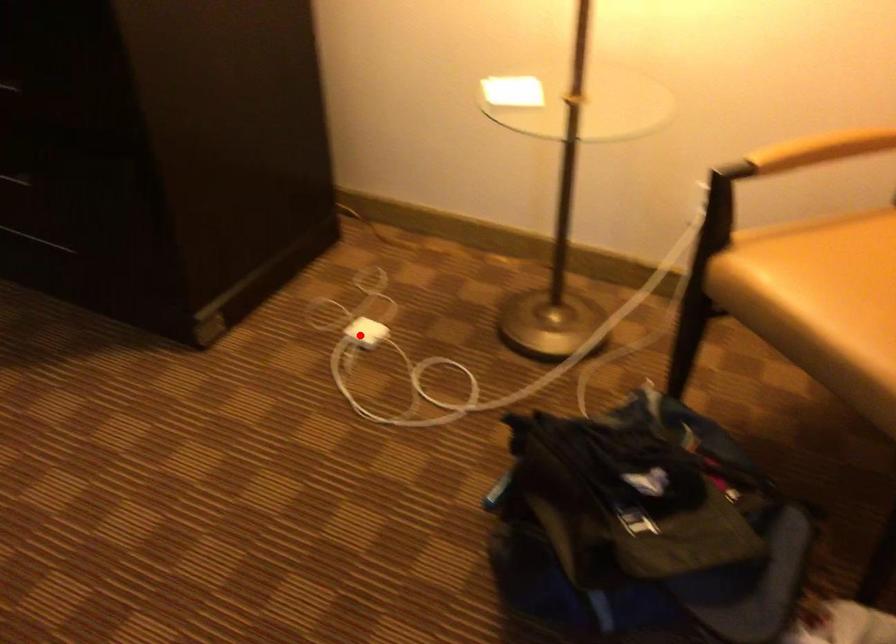
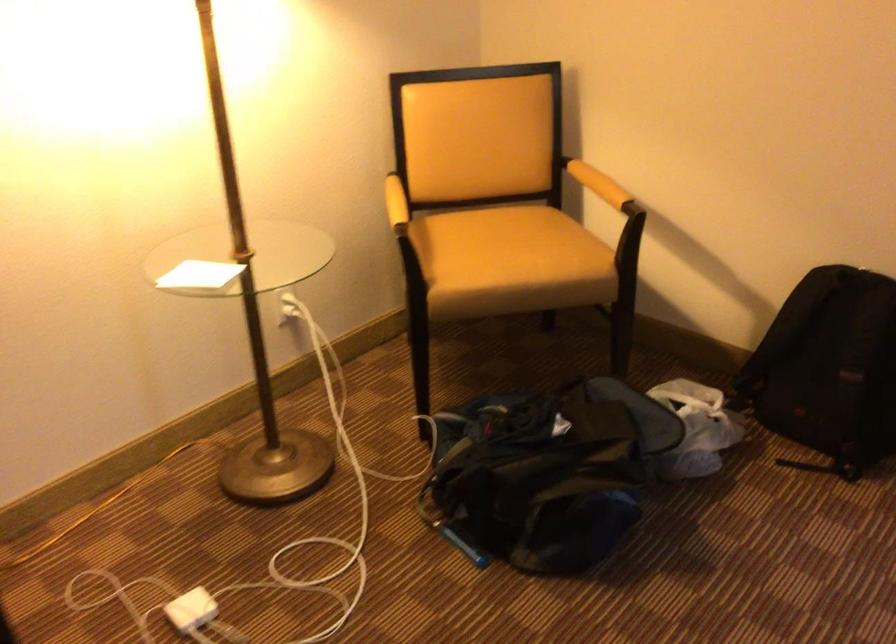
Question: I am providing you with two images of the same scene from different viewpoints. Image1 has a red point marked. In image2, the corresponding 3D location appears at what relative position? Reply with the corresponding letter.

Choices:
 (A) Closer
 (B) Farther

Answer: (A)